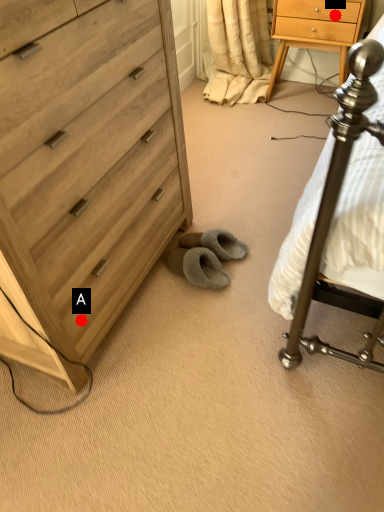
Question: Two points are circled on the image, labeled by A and B beside each circle. Among these points, which one is nearest to the camera?

Choices:
 (A) A is closer
 (B) B is closer

Answer: (A)